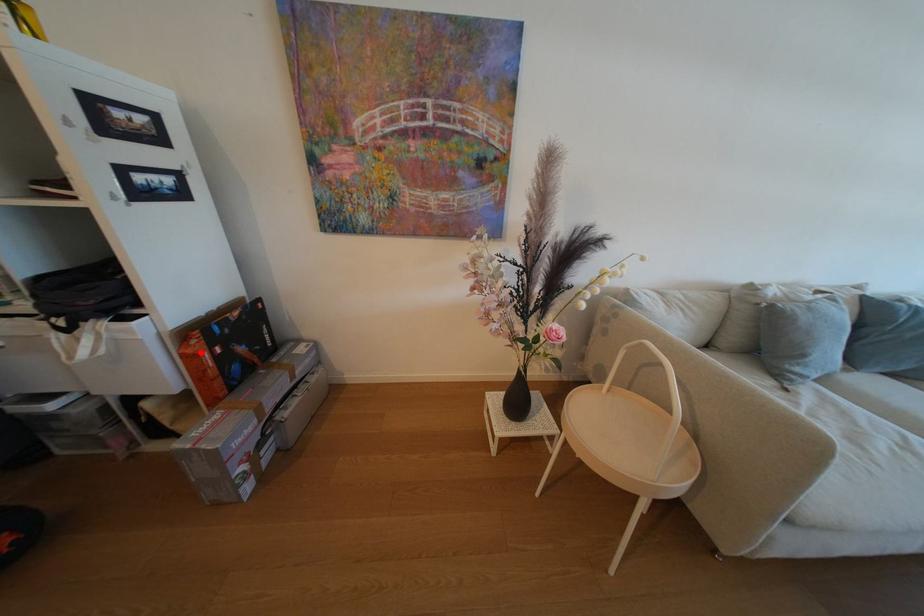
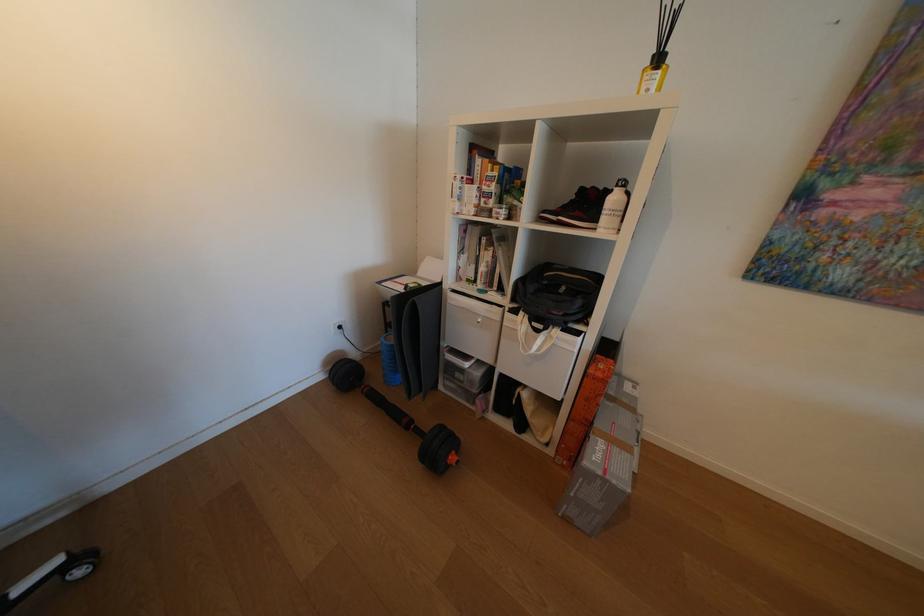
In the second image, find the point that corresponds to the highlighted location in the first image.

(611, 376)